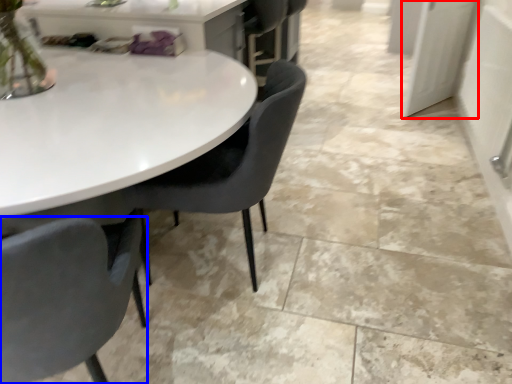
Question: Which point is closer to the camera, glass door (highlighted by a red box) or chair (highlighted by a blue box)?

Choices:
 (A) glass door
 (B) chair

Answer: (B)